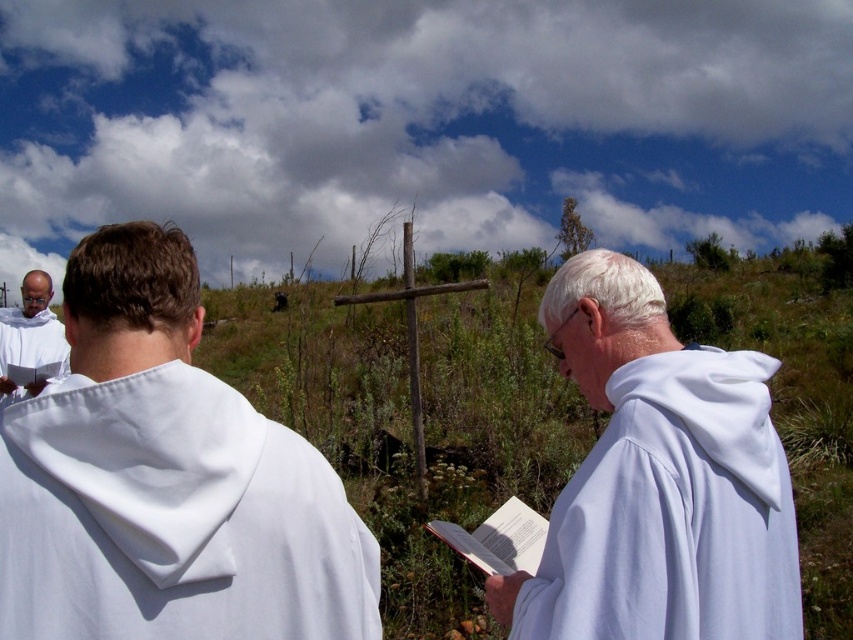
You are a photographer trying to capture the scene. You notice two items at the left side of the image. Which one is positioned lower between the white cloth at left and the white clothed figure at left?

The white cloth at left is located below the white clothed figure at left, so the white cloth at left is positioned lower.

You are a photographer standing in the scene and want to take a closeup photo of the white cloth book at center without moving any objects. Can you reach the book from your current position?

The white cloth book at center is 1.46 meters away from the viewer, so yes, you can reach it from your current position if your arm or camera can extend that far.